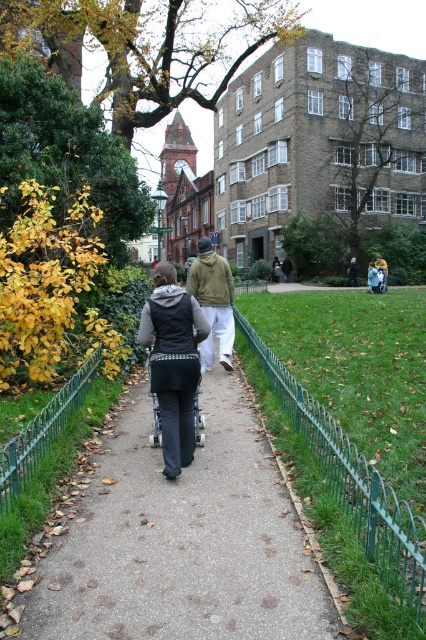
You are a photographer standing at the center of the paved pathway in the park. You want to take a photo that includes both the light brown cotton hoodie at center and the matte green jacket at center. What is the minimum distance you need to move forward or backward to ensure both are in frame?

The light brown cotton hoodie at center and the matte green jacket at center are 14.05 meters apart. To capture both in the same frame, you need to move back until the entire 14.05 meters between them fits within your camera lens view. The exact distance depends on your camera lens, but generally, moving back several meters should help include both subjects.

You are standing at the center of the park pathway and see two people walking towards each other. The first person is wearing a light brown cotton hoodie at center, and the second is wearing a matte green jacket at center. Which of these two jackets is positioned lower in the image?

The light brown cotton hoodie at center is located below the matte green jacket at center, so it is positioned lower in the image.

You are a pedestrian standing at the center of the path in the park. You notice two individuals ahead of you wearing different jackets. The first person is wearing a matte black vest at center, and the second is wearing a matte green jacket at center. Which jacket is positioned to the left when facing the direction you are walking?

The matte black vest at center is positioned to the left of the matte green jacket at center when facing the direction you are walking.